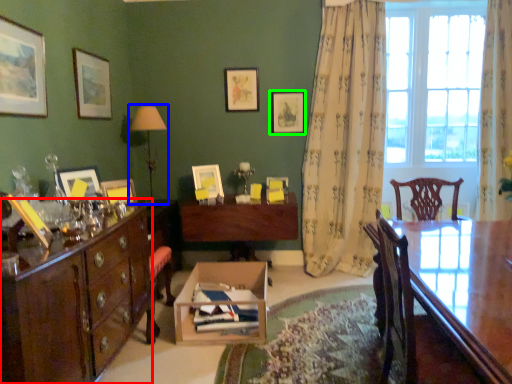
Question: Which object is positioned farthest from cabinetry (highlighted by a red box)? Select from table lamp (highlighted by a blue box) and picture frame (highlighted by a green box).

Choices:
 (A) table lamp
 (B) picture frame

Answer: (B)